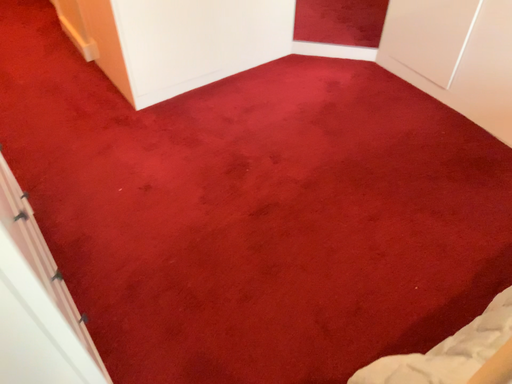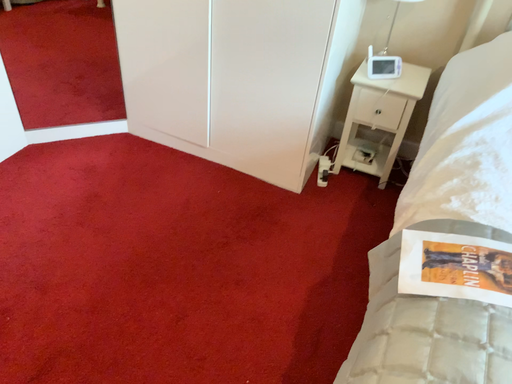
Question: How did the camera likely rotate when shooting the video?

Choices:
 (A) rotated right
 (B) rotated left

Answer: (A)